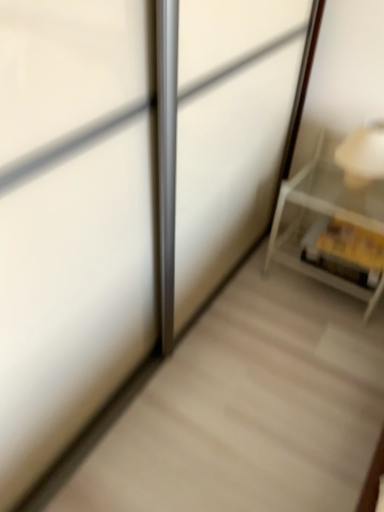
Identify the location of vacant space positioned to the left of white glossy side table at right. (255, 302).